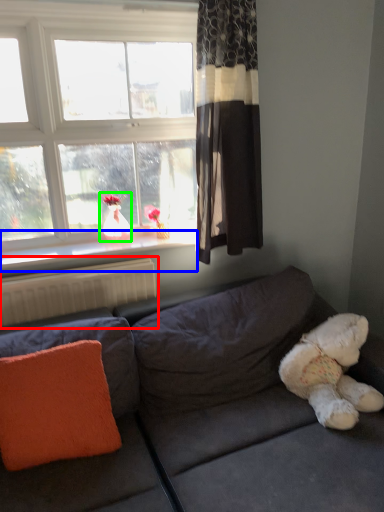
Question: Which object is the closest to the radiator (highlighted by a red box)? Choose among these: window sill (highlighted by a blue box) or doll (highlighted by a green box).

Choices:
 (A) window sill
 (B) doll

Answer: (A)